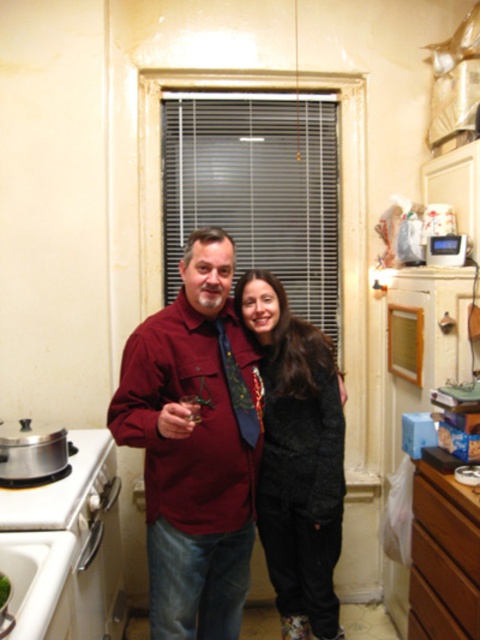
The width and height of the screenshot is (480, 640). Describe the element at coordinates (194, 445) in the screenshot. I see `maroon fabric shirt at center` at that location.

Does point (213, 499) come farther from viewer compared to point (336, 486)?

No, (213, 499) is closer to viewer.

Identify the location of maroon fabric shirt at center. Image resolution: width=480 pixels, height=640 pixels. (194, 445).

The height and width of the screenshot is (640, 480). What do you see at coordinates (297, 458) in the screenshot? I see `black fuzzy coat at center` at bounding box center [297, 458].

Can you confirm if black fuzzy coat at center is shorter than brown wood drawer at lower right?

No, black fuzzy coat at center is not shorter than brown wood drawer at lower right.

Which is in front, point (235, 289) or point (467, 612)?

Point (467, 612) is more forward.

This screenshot has height=640, width=480. Find the location of `black fuzzy coat at center`. black fuzzy coat at center is located at coordinates (297, 458).

Which is more to the right, maroon fabric shirt at center or brown wood drawer at lower right?

From the viewer's perspective, brown wood drawer at lower right appears more on the right side.

Consider the image. Can you confirm if maroon fabric shirt at center is taller than brown wood drawer at lower right?

Correct, maroon fabric shirt at center is much taller as brown wood drawer at lower right.

In order to click on maroon fabric shirt at center in this screenshot , I will do `click(194, 445)`.

You are a GUI agent. You are given a task and a screenshot of the screen. Output one action in this format:
    pyautogui.click(x=<x>, y=<y>)
    Task: Click on the maroon fabric shirt at center
    This screenshot has width=480, height=640.
    Given the screenshot: What is the action you would take?
    pyautogui.click(x=194, y=445)